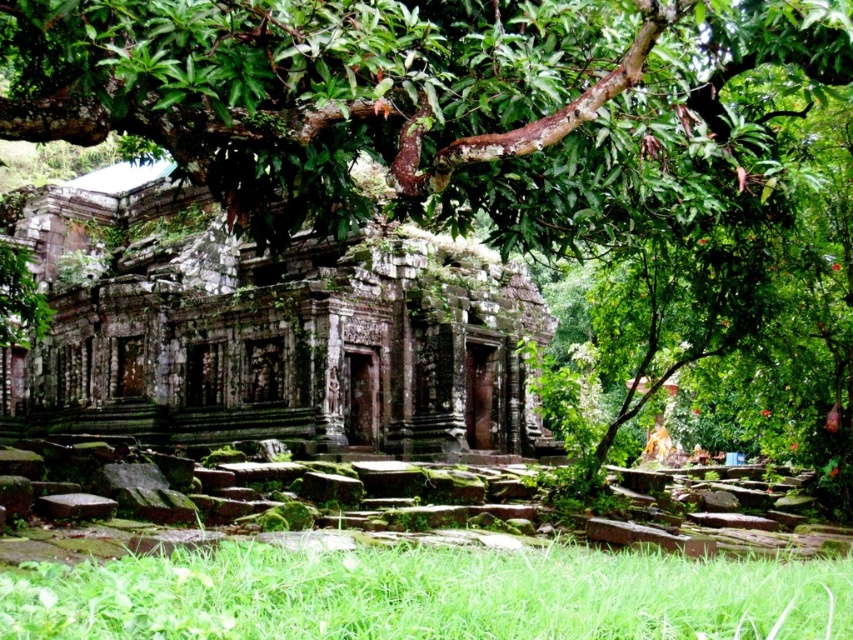
You are a hiker who wants to take a clear photo of the ancient stone temple ruins. However, the green leafy tree at upper center and the green grass at lower center are blocking your view. Which object is blocking your view more significantly?

The green leafy tree at upper center is blocking your view more significantly because it is taller than the green grass at lower center.

You are standing at the center of the ancient stone structure and want to take a photo of the green leafy tree at upper center. According to the scene description, where should you aim your camera to capture the tree in the frame?

The green leafy tree at upper center is located at coordinates point (421, 100), so you should aim your camera towards the upper center direction to capture it.

You are standing at the base of the large tree with broad leaves in the scene. You notice two points marked in the image. Which point, point (42, 132) or point (67, 196), is closer to you?

Point (42, 132) is closer to you because it is in front of point (67, 196).